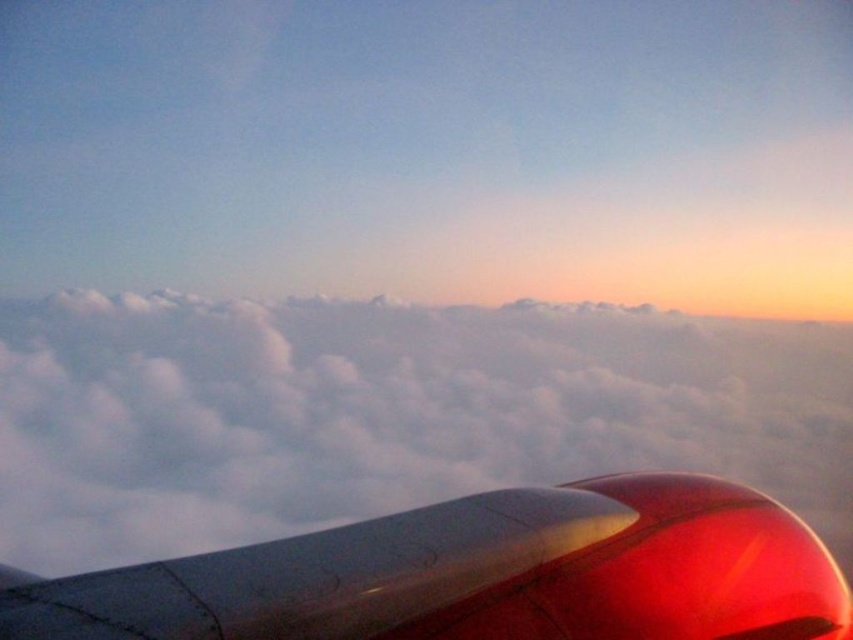
You are a passenger on the plane and want to take a photo of the glossy metallic engine at lower right without the white fluffy cloud at center blocking it. Is there a way to position yourself so the cloud isn not in front of the engine?

The glossy metallic engine at lower right is behind the white fluffy cloud at center, so you cannot position yourself to avoid the cloud blocking the engine since the engine is already behind the cloud from your viewpoint.

You are a pilot flying an aircraft and need to navigate around the white fluffy cloud at center. Based on the coordinates provided, can you determine if the cloud is positioned closer to the left or right side of the aircraft?

The white fluffy cloud at center is located at coordinates point (386, 413). Since the x coordinate is 0.647, which is closer to 1 than to 0, the cloud is positioned closer to the right side of the aircraft.